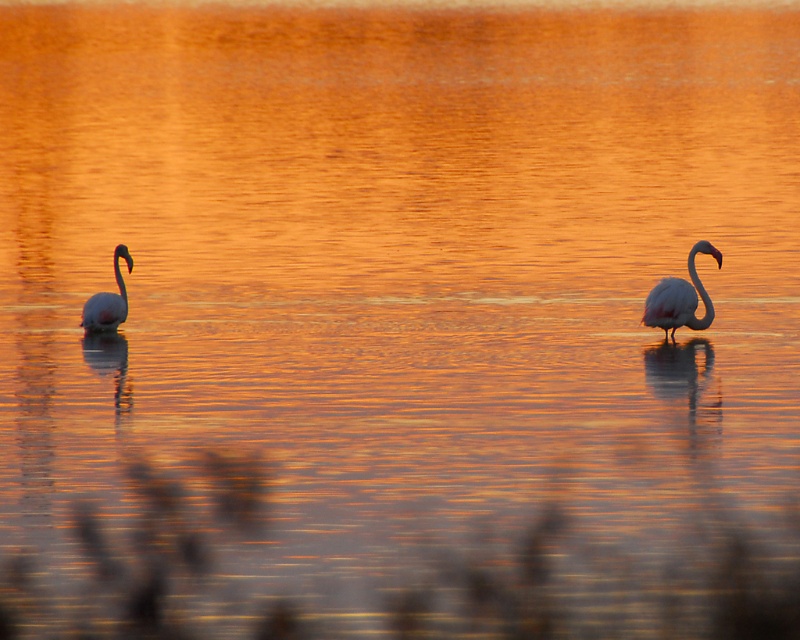
Can you confirm if pink matte swan at right is wider than pink feathered swan at left?

Indeed, pink matte swan at right has a greater width compared to pink feathered swan at left.

The height and width of the screenshot is (640, 800). Describe the element at coordinates (680, 298) in the screenshot. I see `pink matte swan at right` at that location.

Image resolution: width=800 pixels, height=640 pixels. In order to click on pink matte swan at right in this screenshot , I will do `click(680, 298)`.